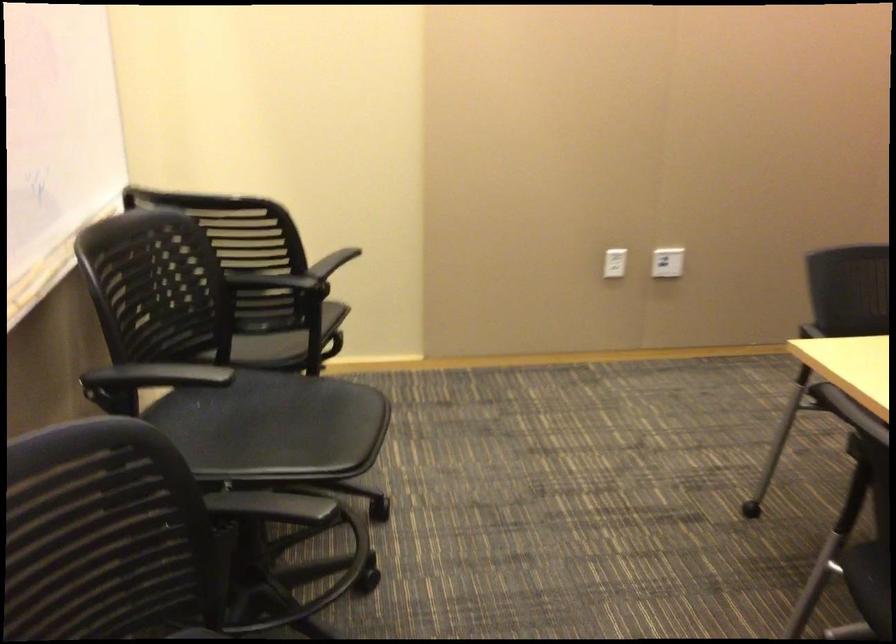
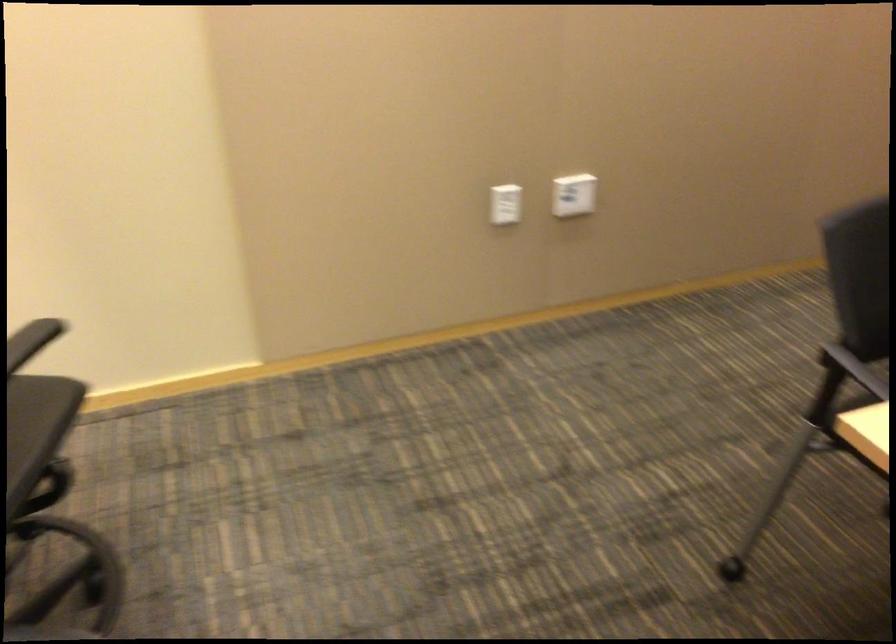
Question: Which direction would the cameraman need to move to produce the second image? Reply with the corresponding letter.

Choices:
 (A) Left
 (B) Right
 (C) Forward
 (D) Backward

Answer: (C)